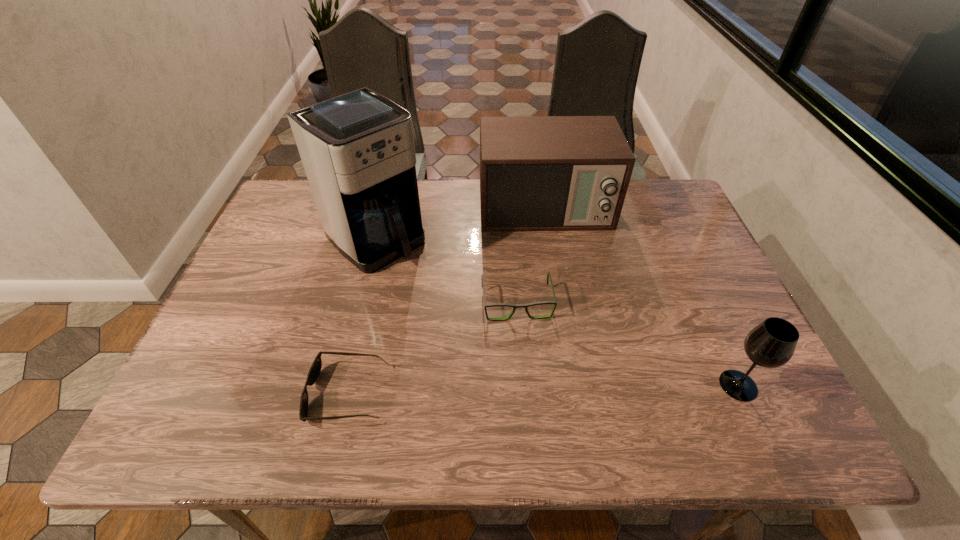
Where is `free area in between the sunglasses and the tallest object`? The image size is (960, 540). free area in between the sunglasses and the tallest object is located at coordinates 362,316.

The width and height of the screenshot is (960, 540). What are the coordinates of `empty space that is in between the third shortest object and the second shortest object` in the screenshot? It's located at (628, 344).

Identify which object is the third nearest to the third farthest object. Please provide its 2D coordinates. Your answer should be formatted as a tuple, i.e. [(x, y)], where the tuple contains the x and y coordinates of a point satisfying the conditions above.

[(316, 366)]

Find the location of `object that is the fourth closest to the second shortest object`. object that is the fourth closest to the second shortest object is located at coordinates (771, 344).

Image resolution: width=960 pixels, height=540 pixels. Identify the location of free space that satisfies the following two spatial constraints: 1. on the front side of the coffee maker; 2. on the lenses of the sunglasses. (338, 394).

You are a GUI agent. You are given a task and a screenshot of the screen. Output one action in this format:
    pyautogui.click(x=<x>, y=<y>)
    Task: Click on the vacant point that satisfies the following two spatial constraints: 1. on the front side of the tallest object; 2. on the right side of the third nearest object
    
    Given the screenshot: What is the action you would take?
    pyautogui.click(x=360, y=303)

The width and height of the screenshot is (960, 540). I want to click on free location that satisfies the following two spatial constraints: 1. on the front side of the rightmost object; 2. on the right side of the second tallest object, so click(574, 385).

This screenshot has width=960, height=540. Find the location of `free space that satisfies the following two spatial constraints: 1. on the front side of the wineglass; 2. on the right side of the tallest object`. free space that satisfies the following two spatial constraints: 1. on the front side of the wineglass; 2. on the right side of the tallest object is located at coordinates (340, 385).